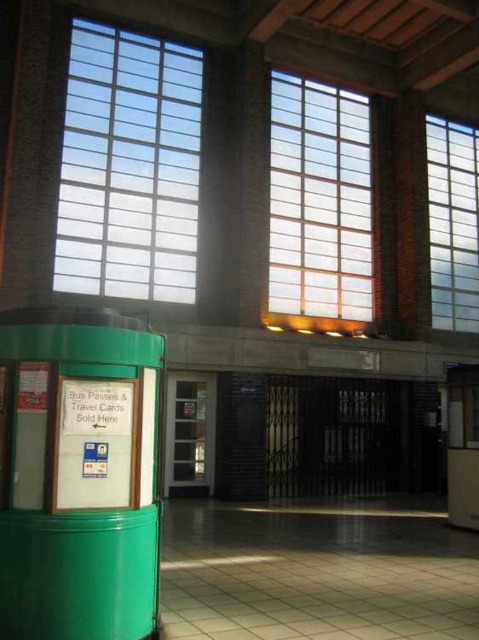
You are standing at the entrance of the transportation hub and want to look through both the transparent glass window at upper left and the clear glass window at upper right. Which window should you approach first to see the one behind it?

The transparent glass window at upper left is in front of the clear glass window at upper right, so you should approach the transparent glass window at upper left first to see the clear glass window at upper right behind it.

You are a passenger in the station and want to check the schedule displayed on the transparent glass window at upper left and the clear glass window at upper right. Which window is higher up?

The transparent glass window at upper left is located above the clear glass window at upper right, so it is higher up.